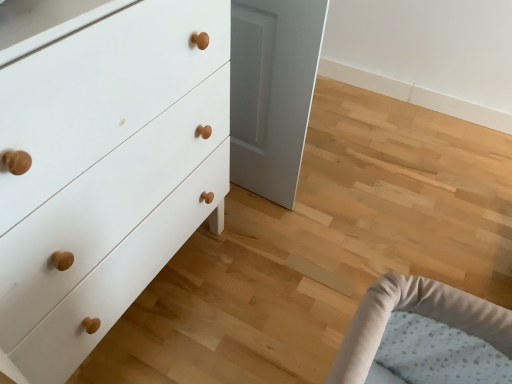
Describe the element at coordinates (106, 172) in the screenshot. I see `white matte wood chest of drawers at left` at that location.

Where is `white matte wood chest of drawers at left`? Image resolution: width=512 pixels, height=384 pixels. white matte wood chest of drawers at left is located at coordinates (106, 172).

Where is `white matte wood chest of drawers at left`? The height and width of the screenshot is (384, 512). white matte wood chest of drawers at left is located at coordinates (106, 172).